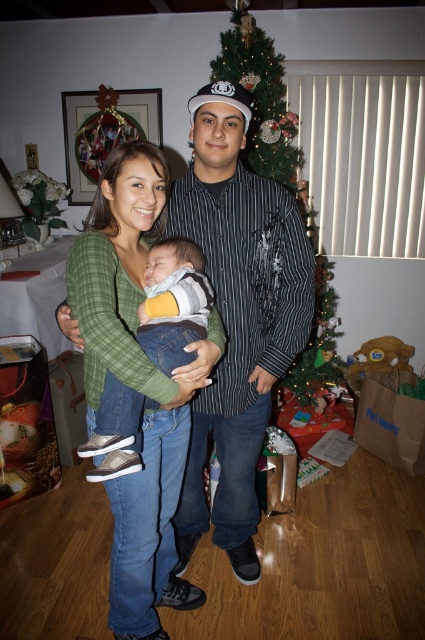
Does matte black shirt at center have a smaller size compared to matte gray sneakers at center?

Incorrect, matte black shirt at center is not smaller in size than matte gray sneakers at center.

Between matte black shirt at center and matte gray sneakers at center, which one is positioned higher?

matte gray sneakers at center is above.

Which is behind, point (220, 154) or point (141, 332)?

The point (220, 154) is more distant.

At what (x,y) coordinates should I click in order to perform the action: click on matte black shirt at center. Please return your answer as a coordinate pair (x, y). Looking at the image, I should click on (238, 317).

Which is below, matte black shirt at center or green textured christmas tree at center?

matte black shirt at center is lower down.

Between point (246, 465) and point (232, 13), which one is positioned behind?

The point (232, 13) is more distant.

This screenshot has height=640, width=425. What are the coordinates of `matte black shirt at center` in the screenshot? It's located at (238, 317).

Is green textured christmas tree at center thinner than matte gray sneakers at center?

No.

This screenshot has height=640, width=425. In order to click on green textured christmas tree at center in this screenshot , I will do `click(265, 108)`.

Who is more distant from viewer, (312,349) or (198,285)?

Point (312,349)

This screenshot has width=425, height=640. What are the coordinates of `green textured christmas tree at center` in the screenshot? It's located at (265, 108).